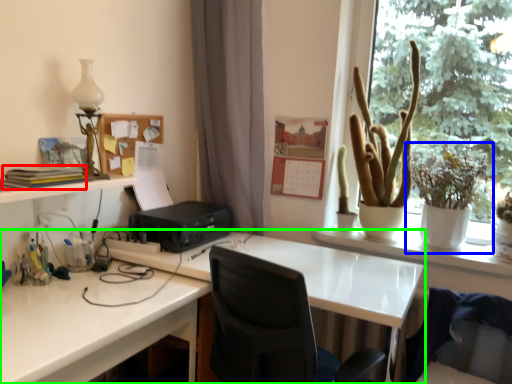
Question: Which is farther away from book (highlighted by a red box)? houseplant (highlighted by a blue box) or desk (highlighted by a green box)?

Choices:
 (A) houseplant
 (B) desk

Answer: (A)